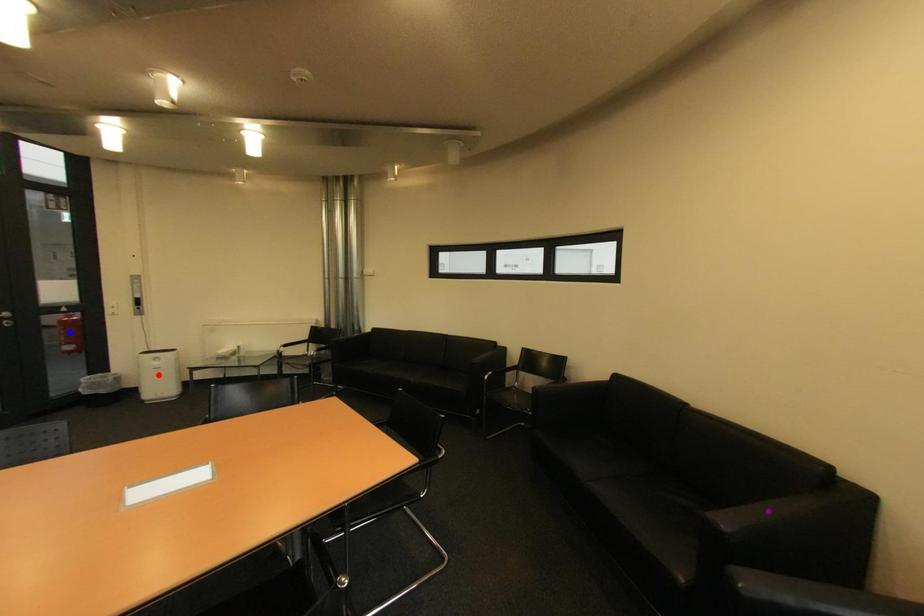
Order these from nearest to farthest:
purple point | red point | blue point

blue point, red point, purple point